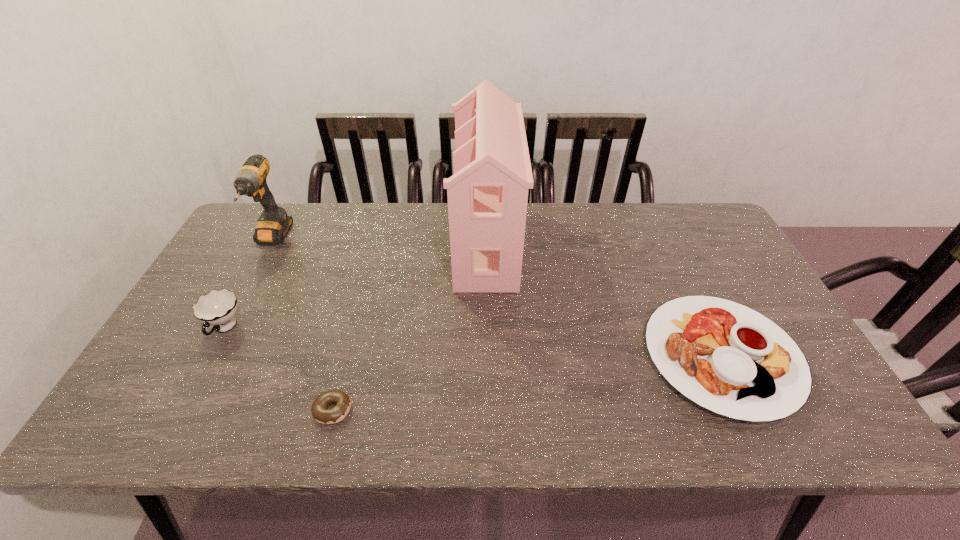
The image size is (960, 540). Find the location of `vacant space positioned on the front-facing side of the fourth object from left to right`. vacant space positioned on the front-facing side of the fourth object from left to right is located at coordinates [x=403, y=244].

The height and width of the screenshot is (540, 960). What are the coordinates of `free region located with the drill bit of the drill facing forward` in the screenshot? It's located at (217, 341).

Where is `vacant space situated 0.230m on the side of the third shortest object with the handle`? Image resolution: width=960 pixels, height=540 pixels. vacant space situated 0.230m on the side of the third shortest object with the handle is located at coordinates (168, 436).

In order to click on vacant space positioned on the left of the platter in this screenshot , I will do `click(504, 356)`.

What are the coordinates of `free space located 0.260m on the left of the doughnut` in the screenshot? It's located at (198, 409).

You are a GUI agent. You are given a task and a screenshot of the screen. Output one action in this format:
    pyautogui.click(x=<x>, y=<y>)
    Task: Click on the dollhouse present at the far edge
    The image size is (960, 540).
    Given the screenshot: What is the action you would take?
    pyautogui.click(x=487, y=196)

I want to click on drill located in the far edge section of the desktop, so click(x=273, y=224).

Find the location of a particular element. platter at the near edge is located at coordinates (726, 357).

Locate an element on the screen. The image size is (960, 540). doughnut located in the near edge section of the desktop is located at coordinates (320, 412).

The image size is (960, 540). In order to click on drill that is at the left edge in this screenshot , I will do `click(273, 224)`.